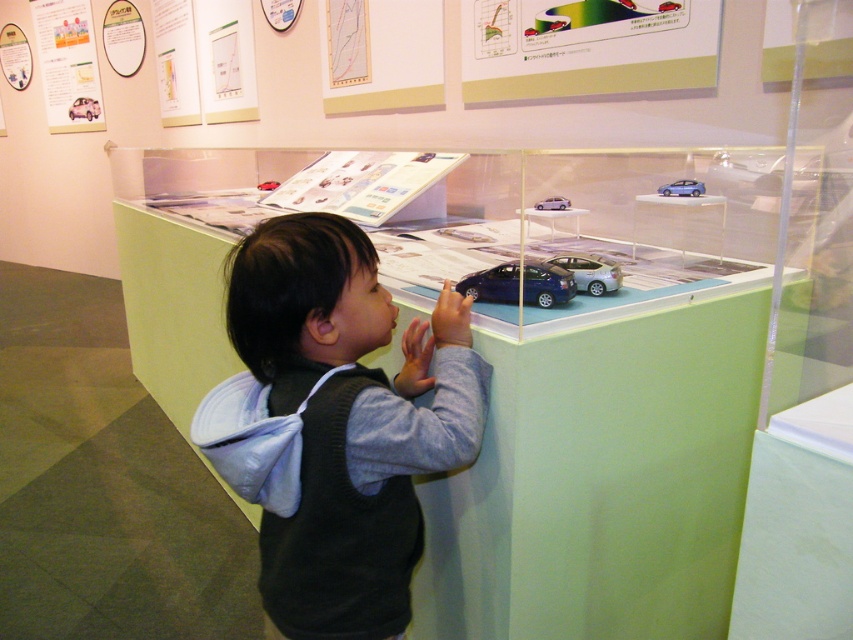
Question: Which point is closer to the camera taking this photo?

Choices:
 (A) (677, 179)
 (B) (598, 272)
 (C) (550, 202)

Answer: (B)

Question: From the image, what is the correct spatial relationship of satin blue car at center in relation to satin silver car at center?

Choices:
 (A) above
 (B) below

Answer: (B)

Question: Among these points, which one is farthest from the camera?

Choices:
 (A) (564, 198)
 (B) (692, 186)
 (C) (271, 570)

Answer: (A)

Question: Based on their relative distances, which object is farther from the satin purple car at center?

Choices:
 (A) satin silver car at center
 (B) satin blue car at center
 (C) gray fleece vest at center
 (D) metallic blue car at upper center

Answer: (C)

Question: Does gray fleece vest at center have a smaller size compared to satin purple car at center?

Choices:
 (A) yes
 (B) no

Answer: (B)

Question: Is satin blue car at center thinner than satin silver car at center?

Choices:
 (A) yes
 (B) no

Answer: (B)